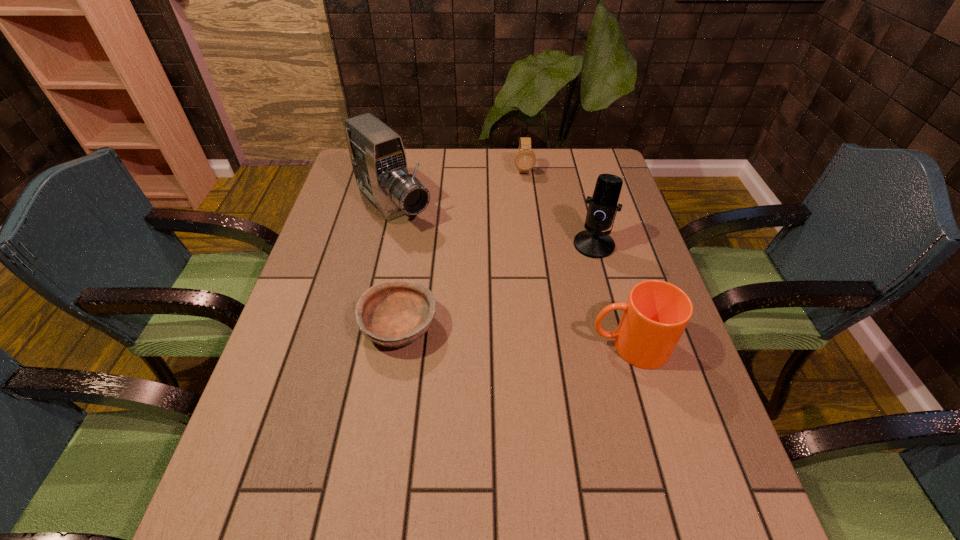
Image resolution: width=960 pixels, height=540 pixels. What are the coordinates of `vacant space on the desktop that is between the bowl and the third shortest object and is positioned on the stand of the microphone` in the screenshot? It's located at (516, 336).

The height and width of the screenshot is (540, 960). In order to click on free space on the desktop that is between the bowl and the third shortest object and is positioned at the front of the camcorder, highlighting the lens in this screenshot , I will do `click(519, 337)`.

Find the location of a particular element. The image size is (960, 540). vacant spot on the desktop that is between the bowl and the mug and is positioned on the face of the farthest object is located at coordinates (544, 339).